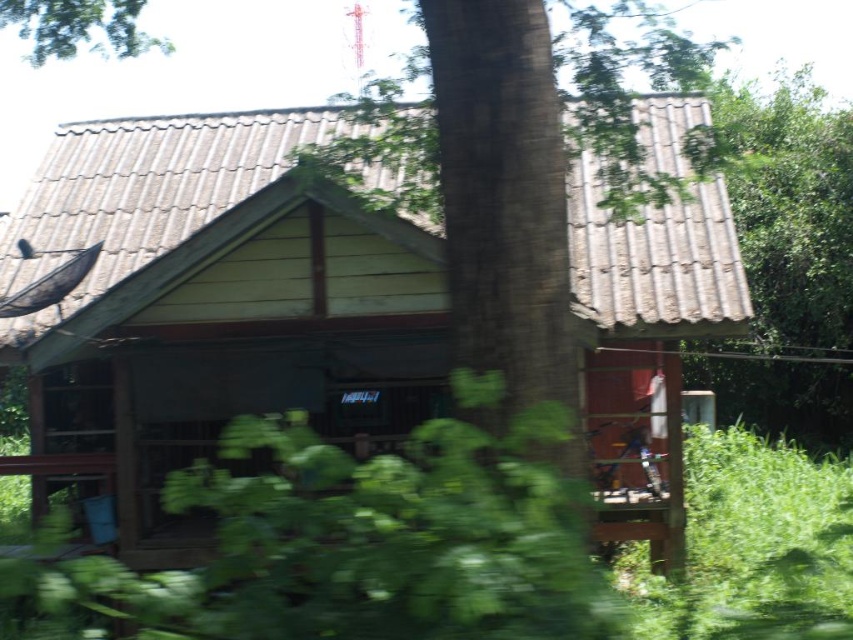
Question: Considering the real-world distances, which object is closest to the green leafy tree at upper right?

Choices:
 (A) green leafy tree at upper left
 (B) brown rough bark tree at center
 (C) green leafy plant at center

Answer: (A)

Question: Does wooden cabin at center come behind green leafy plant at center?

Choices:
 (A) no
 (B) yes

Answer: (B)

Question: Which point is closer to the camera?

Choices:
 (A) (550, 388)
 (B) (55, 54)
 (C) (137, 148)

Answer: (A)

Question: Which point appears closest to the camera in this image?

Choices:
 (A) (538, 145)
 (B) (809, 301)
 (C) (416, 451)

Answer: (C)

Question: Where is green leafy plant at center located in relation to green leafy tree at upper left in the image?

Choices:
 (A) right
 (B) left

Answer: (A)

Question: Is brown rough bark tree at center positioned in front of green leafy tree at upper right?

Choices:
 (A) yes
 (B) no

Answer: (A)